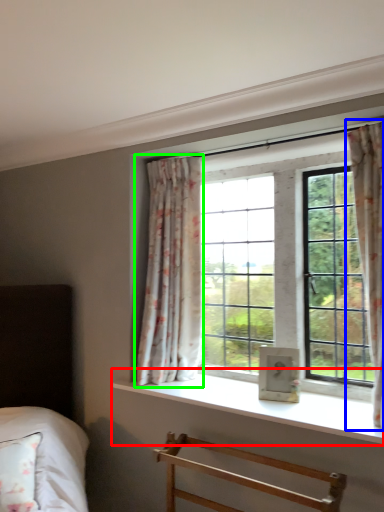
Question: Which object is the farthest from window sill (highlighted by a red box)? Choose among these: curtain (highlighted by a blue box) or curtain (highlighted by a green box).

Choices:
 (A) curtain
 (B) curtain

Answer: (A)